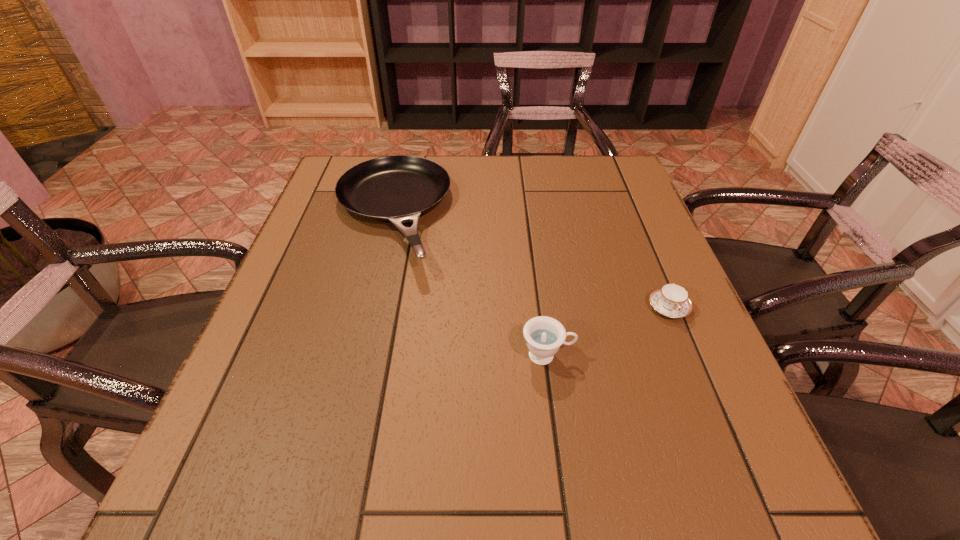
This screenshot has height=540, width=960. Find the location of `object at the left edge`. object at the left edge is located at coordinates (399, 188).

At what (x,y) coordinates should I click in order to perform the action: click on object located in the right edge section of the desktop. Please return your answer as a coordinate pair (x, y). This screenshot has height=540, width=960. Looking at the image, I should click on (671, 300).

At what (x,y) coordinates should I click in order to perform the action: click on object present at the far left corner. Please return your answer as a coordinate pair (x, y). Looking at the image, I should click on (399, 188).

Find the location of `vacant area at the far edge`. vacant area at the far edge is located at coordinates (525, 187).

In the image, there is a desktop. At what (x,y) coordinates should I click in order to perform the action: click on free space at the near edge. Please return your answer as a coordinate pair (x, y). Looking at the image, I should click on (475, 482).

You are a GUI agent. You are given a task and a screenshot of the screen. Output one action in this format:
    pyautogui.click(x=<x>, y=<y>)
    Task: Click on the vacant space at the left edge of the desktop
    This screenshot has height=540, width=960.
    Given the screenshot: What is the action you would take?
    pyautogui.click(x=293, y=324)

At what (x,y) coordinates should I click in order to perform the action: click on vacant area at the right edge of the desktop. Please return your answer as a coordinate pair (x, y). Looking at the image, I should click on (659, 444).

In the image, there is a desktop. Identify the location of vacant space at the far left corner. The image size is (960, 540). (376, 158).

At what (x,y) coordinates should I click in order to perform the action: click on free point at the near left corner. Please return your answer as a coordinate pair (x, y). This screenshot has width=960, height=540. Looking at the image, I should click on (235, 461).

This screenshot has width=960, height=540. I want to click on free space between the pan and the rightmost object, so click(530, 261).